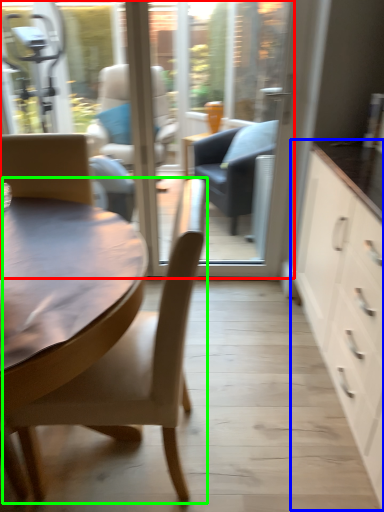
Question: Considering the real-world distances, which object is farthest from window screen (highlighted by a red box)? cabinetry (highlighted by a blue box) or chair (highlighted by a green box)?

Choices:
 (A) cabinetry
 (B) chair

Answer: (B)